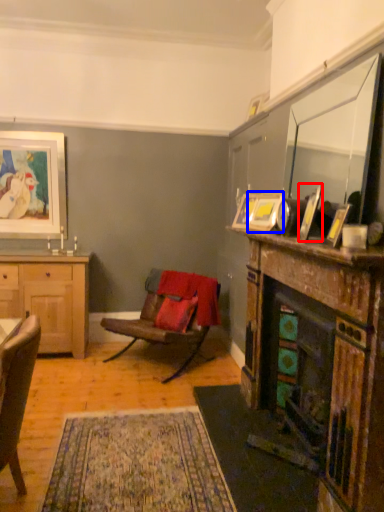
Question: Which of the following is the farthest to the observer, picture frame (highlighted by a red box) or picture frame (highlighted by a blue box)?

Choices:
 (A) picture frame
 (B) picture frame

Answer: (B)